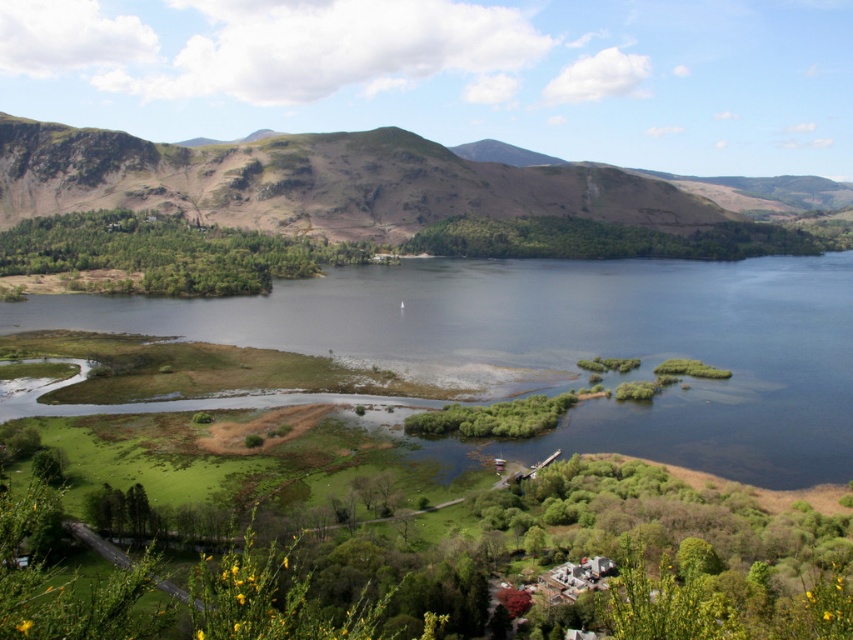
You are an environmental scientist studying the landscape. You need to determine which area is more suitable for setting up a temporary research station based on the size of the available space. Which location would you choose between the clear blue water at lower left and the rugged brown mountain at center?

The rugged brown mountain at center has a larger size compared to the clear blue water at lower left, so the rugged brown mountain at center would be more suitable for setting up a temporary research station due to its larger available space.

Looking at this image, you are standing at the edge of the clear blue water at lower left and want to reach the rugged brown mountain at center. Which direction should you head to get there?

To reach the rugged brown mountain at center from the clear blue water at lower left, you should head upward since the mountain is above the water.

You are planning to build a small dock on the edge of the clear blue water at lower left. Considering the width of the rugged brown mountain at center, will the dock fit comfortably without being too cramped?

The clear blue water at lower left has a lesser width compared to rugged brown mountain at center, so the dock may fit but might feel cramped due to the narrower space available at the clear blue water at lower left.